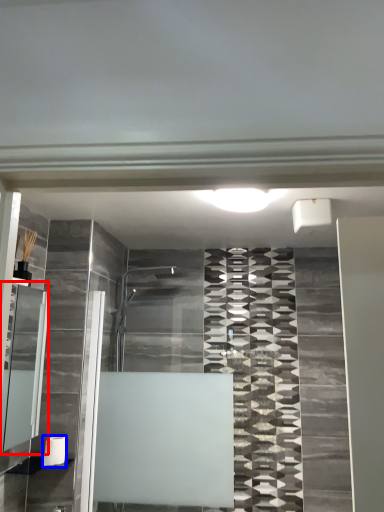
Question: Which object appears closest to the camera in this image, cabinet (highlighted by a red box) or toilet paper (highlighted by a blue box)?

Choices:
 (A) cabinet
 (B) toilet paper

Answer: (A)